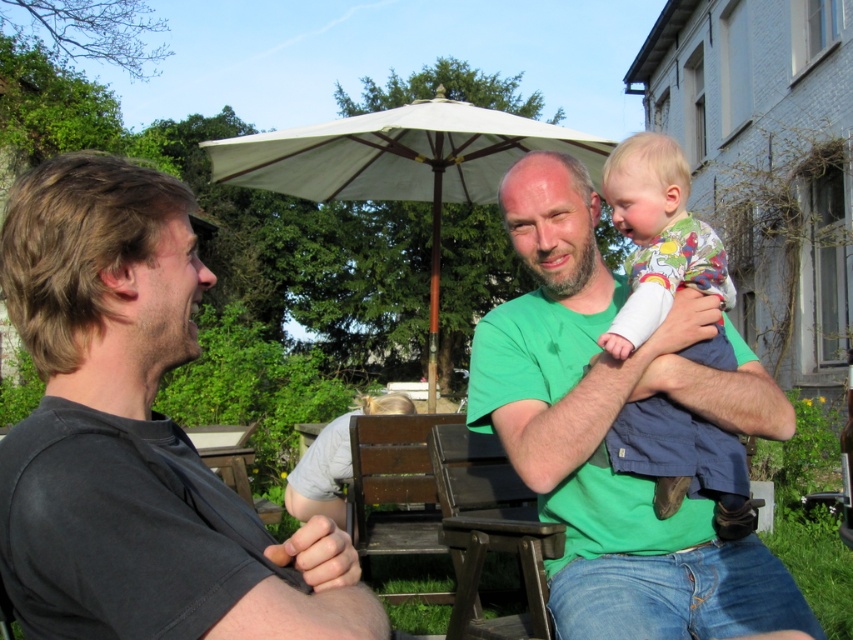
Is floral fabric baby at center positioned in front of white fabric umbrella at center?

That is True.

Is floral fabric baby at center to the left of white fabric umbrella at center from the viewer's perspective?

No, floral fabric baby at center is not to the left of white fabric umbrella at center.

You are a GUI agent. You are given a task and a screenshot of the screen. Output one action in this format:
    pyautogui.click(x=<x>, y=<y>)
    Task: Click on the floral fabric baby at center
    The image size is (853, 640).
    Given the screenshot: What is the action you would take?
    pyautogui.click(x=657, y=237)

Who is taller, dark gray t-shirt at left or floral fabric baby at center?

Standing taller between the two is floral fabric baby at center.

Identify the location of dark gray t-shirt at left. This screenshot has width=853, height=640. (134, 436).

The width and height of the screenshot is (853, 640). Identify the location of dark gray t-shirt at left. (134, 436).

Which is more to the right, green cotton shirt at center or white fabric umbrella at center?

green cotton shirt at center

Does green cotton shirt at center have a greater width compared to white fabric umbrella at center?

No, green cotton shirt at center is not wider than white fabric umbrella at center.

Is point (656, 525) more distant than point (286, 163)?

No, (656, 525) is closer to viewer.

This screenshot has width=853, height=640. I want to click on green cotton shirt at center, so click(608, 428).